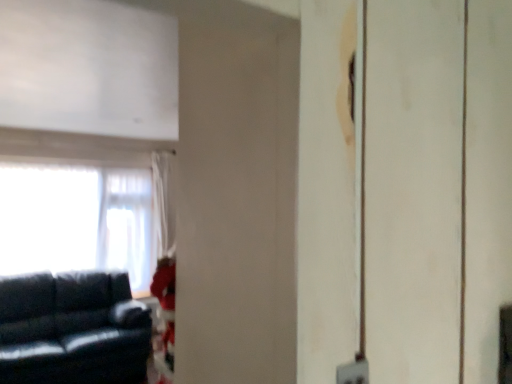
Image resolution: width=512 pixels, height=384 pixels. In order to click on matte black couch at left in this screenshot , I will do `click(72, 329)`.

This screenshot has width=512, height=384. What do you see at coordinates (72, 329) in the screenshot?
I see `matte black couch at left` at bounding box center [72, 329].

The width and height of the screenshot is (512, 384). Describe the element at coordinates (84, 205) in the screenshot. I see `white sheer curtain at left` at that location.

Find the location of a particular element. white sheer curtain at left is located at coordinates (84, 205).

This screenshot has height=384, width=512. I want to click on matte black couch at left, so click(72, 329).

Based on the photo, in the image, is matte black couch at left on the left side or the right side of white sheer curtain at left?

Clearly, matte black couch at left is on the right of white sheer curtain at left in the image.

Does matte black couch at left lie behind white sheer curtain at left?

No, the depth of matte black couch at left is less than that of white sheer curtain at left.

Which is closer, [85,271] or [89,147]?

Clearly, point [85,271] is more distant from the camera than point [89,147].

From the image's perspective, is matte black couch at left over white sheer curtain at left?

Incorrect, from the image's perspective, matte black couch at left is lower than white sheer curtain at left.

From a real-world perspective, which is physically above, matte black couch at left or white sheer curtain at left?

white sheer curtain at left is physically above.

Can you confirm if matte black couch at left is wider than white sheer curtain at left?

Yes.

Between matte black couch at left and white sheer curtain at left, which one has less height?

With less height is matte black couch at left.

Between matte black couch at left and white sheer curtain at left, which one has smaller size?

white sheer curtain at left.

Is matte black couch at left located outside white sheer curtain at left?

Indeed, matte black couch at left is completely outside white sheer curtain at left.

Is matte black couch at left touching white sheer curtain at left?

No, matte black couch at left is not in contact with white sheer curtain at left.

Is matte black couch at left oriented towards white sheer curtain at left?

No, matte black couch at left is not turned towards white sheer curtain at left.

Can you tell me how much matte black couch at left and white sheer curtain at left differ in facing direction?

The facing directions of matte black couch at left and white sheer curtain at left are 0.687 degrees apart.

The width and height of the screenshot is (512, 384). Find the location of `studio couch that is in front of the white sheer curtain at left`. studio couch that is in front of the white sheer curtain at left is located at coordinates (72, 329).

Considering the relative positions of white sheer curtain at left and matte black couch at left in the image provided, is white sheer curtain at left to the left or to the right of matte black couch at left?

Clearly, white sheer curtain at left is on the left of matte black couch at left in the image.

Relative to matte black couch at left, is white sheer curtain at left in front or behind?

white sheer curtain at left is positioned farther from the viewer than matte black couch at left.

Between point (150, 253) and point (9, 372), which one is positioned behind?

Point (150, 253)

From the image's perspective, which is above, white sheer curtain at left or matte black couch at left?

white sheer curtain at left appears higher in the image.

From the picture: From a real-world perspective, is white sheer curtain at left located higher than matte black couch at left?

Correct, in the physical world, white sheer curtain at left is higher than matte black couch at left.

Is white sheer curtain at left thinner than matte black couch at left?

Yes, white sheer curtain at left is thinner than matte black couch at left.

Which of these two, white sheer curtain at left or matte black couch at left, stands shorter?

With less height is matte black couch at left.

Does white sheer curtain at left have a smaller size compared to matte black couch at left?

Correct, white sheer curtain at left occupies less space than matte black couch at left.

Is matte black couch at left surrounded by white sheer curtain at left?

Definitely not — matte black couch at left is not inside white sheer curtain at left.

Are white sheer curtain at left and matte black couch at left beside each other?

No, white sheer curtain at left is not in contact with matte black couch at left.

Is white sheer curtain at left oriented towards matte black couch at left?

No, white sheer curtain at left does not turn towards matte black couch at left.

What's the angular difference between white sheer curtain at left and matte black couch at left's facing directions?

The angular difference between white sheer curtain at left and matte black couch at left is 0.687 degrees.

I want to click on window positioned vertically above the matte black couch at left (from a real-world perspective), so click(84, 205).

Where is `studio couch below the white sheer curtain at left (from the image's perspective)`? The image size is (512, 384). studio couch below the white sheer curtain at left (from the image's perspective) is located at coordinates (72, 329).

This screenshot has height=384, width=512. Find the location of `window above the matte black couch at left (from a real-world perspective)`. window above the matte black couch at left (from a real-world perspective) is located at coordinates (84, 205).